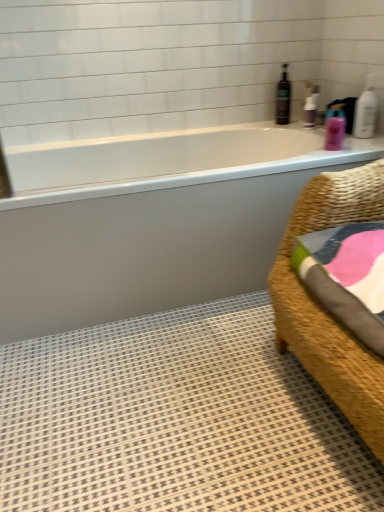
Question: Considering the positions of brown glass bottle at upper right and white glossy bathtub at upper center in the image, is brown glass bottle at upper right taller or shorter than white glossy bathtub at upper center?

Choices:
 (A) short
 (B) tall

Answer: (A)

Question: Looking at the image, does brown glass bottle at upper right seem bigger or smaller compared to white glossy bathtub at upper center?

Choices:
 (A) small
 (B) big

Answer: (A)

Question: Estimate the real-world distances between objects in this image. Which object is farther from the white plastic pump at upper right, the 1th toiletry positioned from the top?

Choices:
 (A) brown glass bottle at upper right
 (B) white glossy bathtub at upper center
 (C) white textured bath mat at lower right
 (D) pink glossy lotion at upper right, marked as the 2th toiletry in a back-to-front arrangement
 (E) woven wicker chair at right

Answer: (C)

Question: Estimate the real-world distances between objects in this image. Which object is farther from the white textured bath mat at lower right?

Choices:
 (A) white glossy bathtub at upper center
 (B) brown glass bottle at upper right
 (C) woven wicker chair at right
 (D) pink glossy lotion at upper right, the 1th toiletry in the bottom-to-top sequence
 (E) white plastic pump at upper right, acting as the first toiletry starting from the back

Answer: (B)